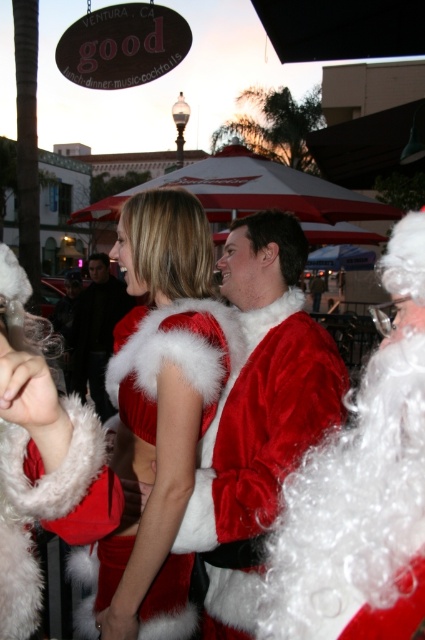
In the scene shown: Is velvet santa at right to the right of velvet red dress at center from the viewer's perspective?

Correct, you'll find velvet santa at right to the right of velvet red dress at center.

Can you confirm if velvet santa at right is positioned to the left of velvet red dress at center?

In fact, velvet santa at right is to the right of velvet red dress at center.

Locate an element on the screen. The image size is (425, 640). velvet santa at right is located at coordinates (362, 488).

This screenshot has height=640, width=425. What are the coordinates of `velvet santa at right` in the screenshot? It's located at (362, 488).

Does velvet red dress at center have a smaller size compared to dark gray fabric jacket at center?

Indeed, velvet red dress at center has a smaller size compared to dark gray fabric jacket at center.

The width and height of the screenshot is (425, 640). Describe the element at coordinates (161, 396) in the screenshot. I see `velvet red dress at center` at that location.

Which is behind, point (170, 516) or point (90, 344)?

Positioned behind is point (90, 344).

Where is `velvet red dress at center`? This screenshot has height=640, width=425. velvet red dress at center is located at coordinates (161, 396).

Can you confirm if velvet santa at right is bigger than velvet santa suit at center?

Incorrect, velvet santa at right is not larger than velvet santa suit at center.

Can you confirm if velvet santa at right is thinner than velvet santa suit at center?

Correct, velvet santa at right's width is less than velvet santa suit at center's.

Where is `velvet santa at right`? The image size is (425, 640). velvet santa at right is located at coordinates (362, 488).